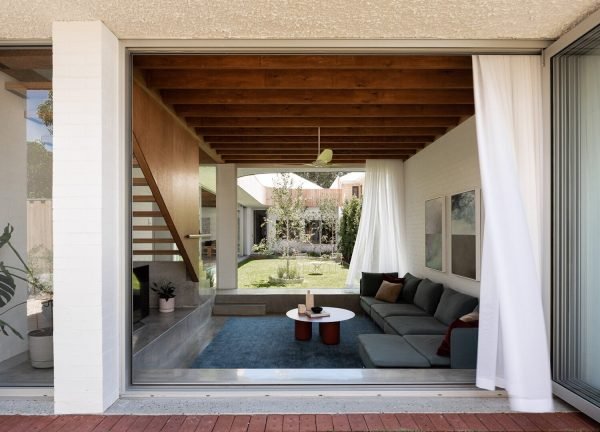
What are the coordinates of `planter` in the screenshot? It's located at (41, 353), (170, 310).